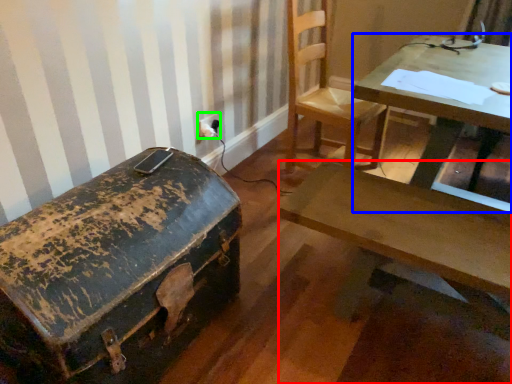
Question: Which is nearer to the desk (highlighted by a red box)? table (highlighted by a blue box) or electric outlet (highlighted by a green box).

Choices:
 (A) table
 (B) electric outlet

Answer: (A)